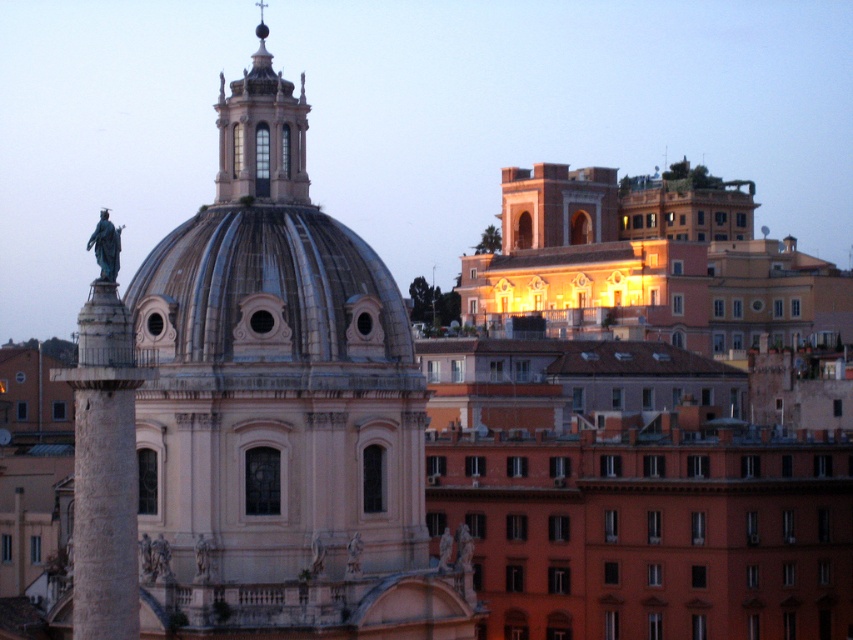
Which of these two, matte orange building at upper right or stone column at left, stands shorter?

Standing shorter between the two is stone column at left.

Which is more to the right, matte orange building at upper right or stone column at left?

matte orange building at upper right

Which is behind, point (595, 244) or point (94, 358)?

The point (595, 244) is more distant.

You are a GUI agent. You are given a task and a screenshot of the screen. Output one action in this format:
    pyautogui.click(x=<x>, y=<y>)
    Task: Click on the matte orange building at upper right
    The image size is (853, 640).
    Given the screenshot: What is the action you would take?
    [643, 262]

Between point (180, 225) and point (99, 289), which one is positioned in front?

Point (99, 289) is in front.

Which is above, shiny metallic dome at center or stone column at left?

shiny metallic dome at center is above.

At what (x,y) coordinates should I click in order to perform the action: click on shiny metallic dome at center. Please return your answer as a coordinate pair (x, y). Image resolution: width=853 pixels, height=640 pixels. Looking at the image, I should click on (267, 289).

Between matte orange building at upper right and shiny metallic dome at center, which one appears on the right side from the viewer's perspective?

From the viewer's perspective, matte orange building at upper right appears more on the right side.

How far apart are matte orange building at upper right and shiny metallic dome at center?

A distance of 63.20 meters exists between matte orange building at upper right and shiny metallic dome at center.

Image resolution: width=853 pixels, height=640 pixels. What are the coordinates of `matte orange building at upper right` in the screenshot? It's located at pos(643,262).

Locate an element on the screen. Image resolution: width=853 pixels, height=640 pixels. matte orange building at upper right is located at coordinates (643, 262).